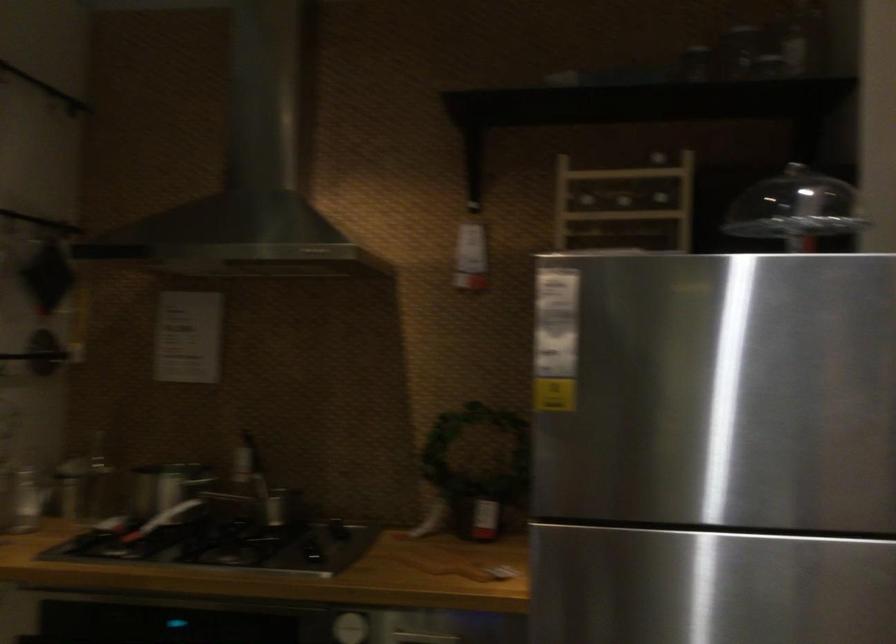
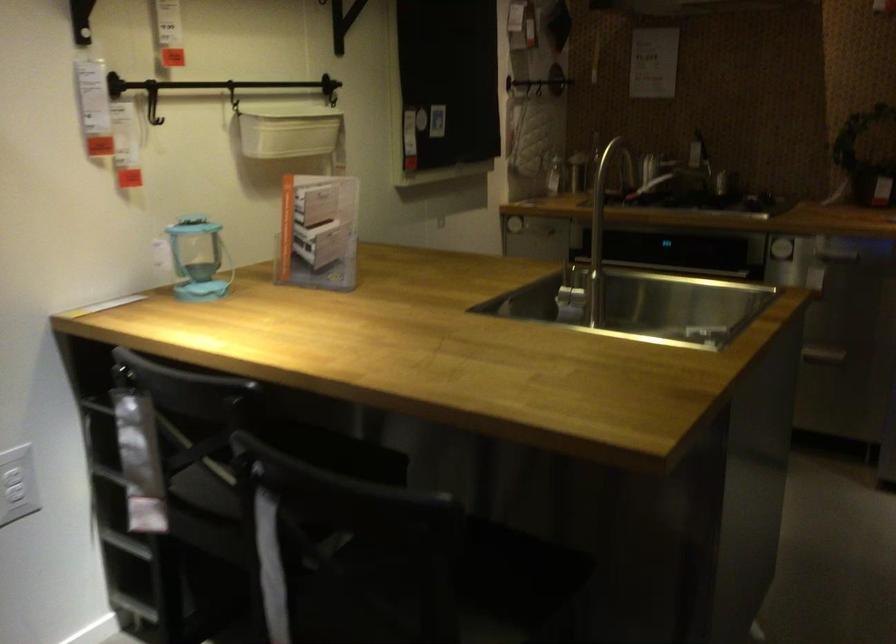
Question: I am providing you with two images of the same scene from different viewpoints. After the viewpoint changes to image2, which objects are now occluded?

Choices:
 (A) white hanging basket
 (B) wine bottle
 (C) acrylic brochure holder
 (D) red cylinder canister

Answer: (B)